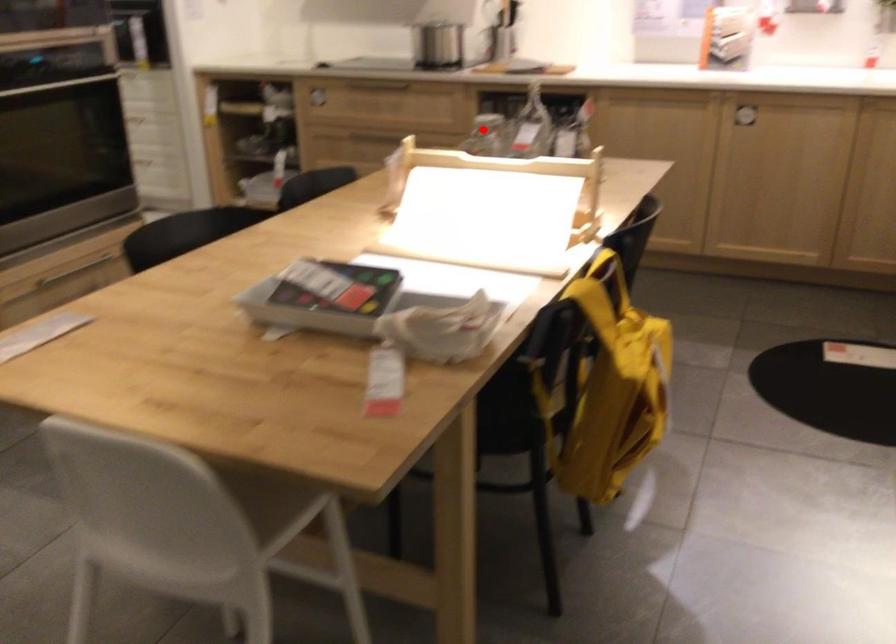
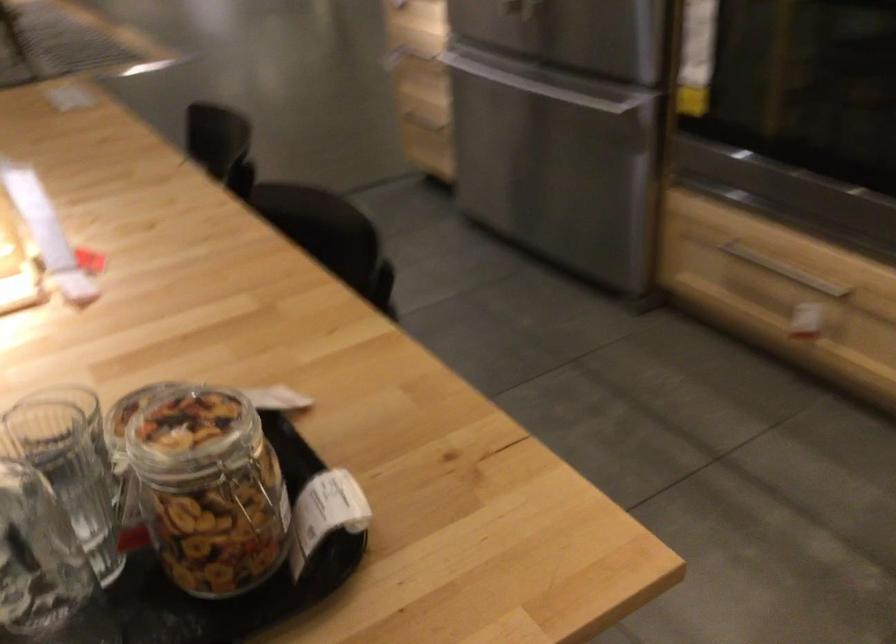
Question: A red point is marked in image1. In image2, is the corresponding 3D point closer to the camera or farther? Reply with the corresponding letter.

Choices:
 (A) The corresponding 3D point is closer.
 (B) The corresponding 3D point is farther.

Answer: (A)